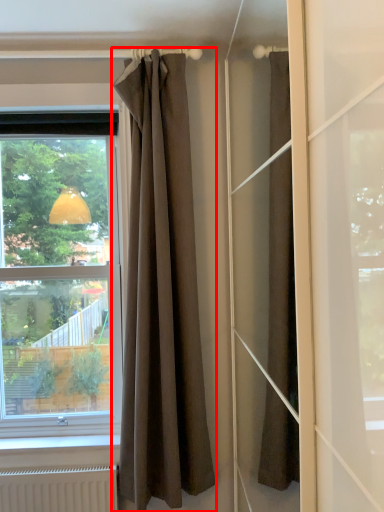
Question: From the image's perspective, where is curtain (annotated by the red box) located relative to window?

Choices:
 (A) below
 (B) above

Answer: (A)